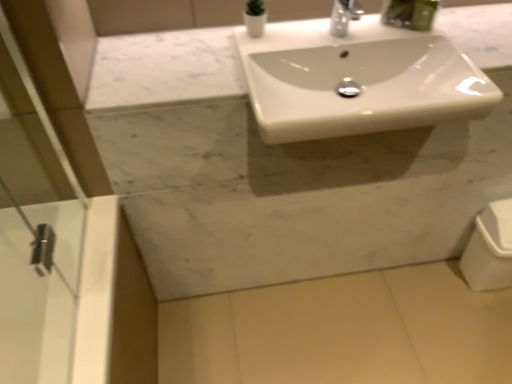
Question: Do you think white glossy sink at center is within white glossy trash can at lower right, or outside of it?

Choices:
 (A) inside
 (B) outside

Answer: (B)

Question: From their relative heights in the image, would you say white glossy sink at center is taller or shorter than white glossy trash can at lower right?

Choices:
 (A) tall
 (B) short

Answer: (B)

Question: Which of these objects is positioned closest to the white glossy trash can at lower right?

Choices:
 (A) white glossy vase at upper center
 (B) white glossy sink at center

Answer: (B)

Question: Based on their relative distances, which object is farther from the white glossy vase at upper center?

Choices:
 (A) white glossy sink at center
 (B) white glossy trash can at lower right

Answer: (B)